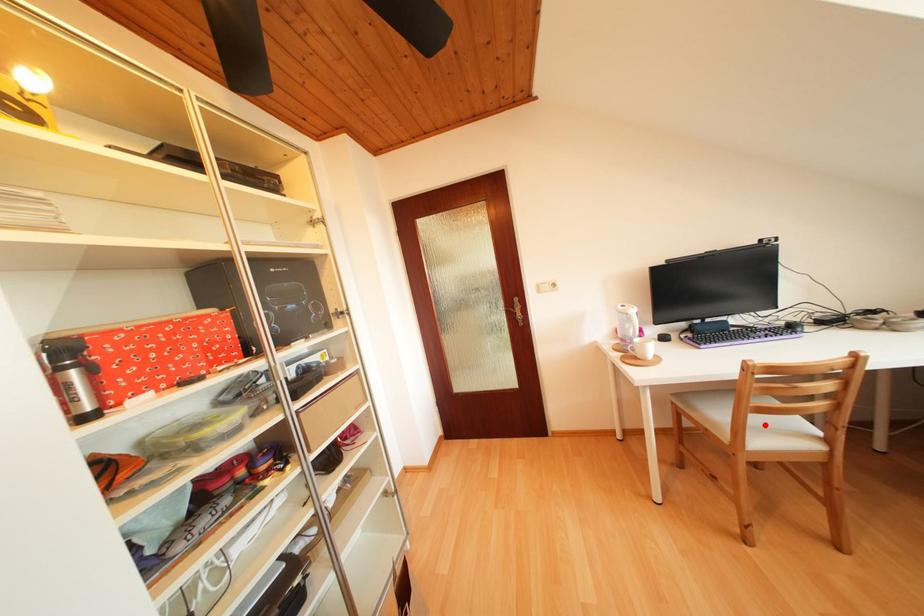
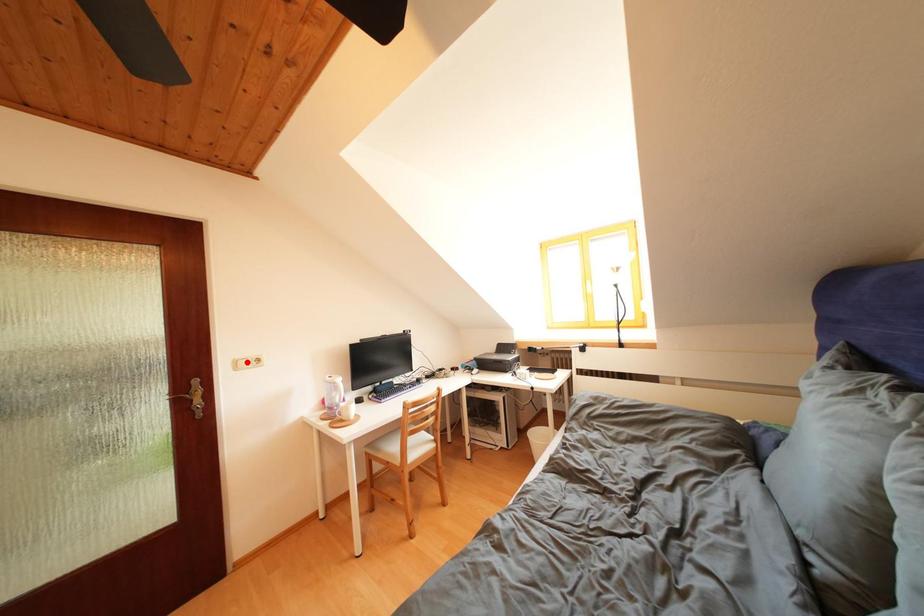
I am providing you with two images of the same scene from different viewpoints. A red point is marked on the first image and another point is marked on the second image. Is the red point in image1 aligned with the point shown in image2?

No